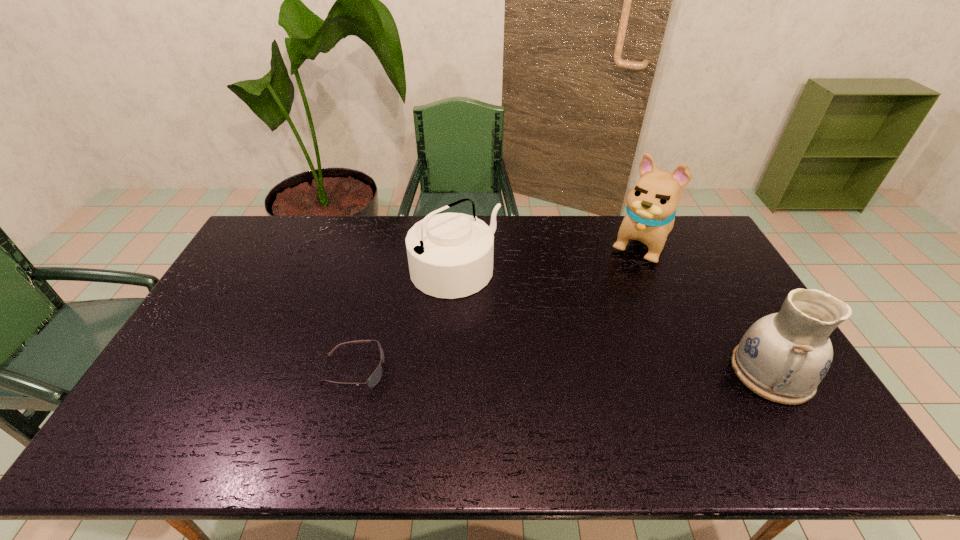
Where is `the shortest object`? the shortest object is located at coordinates (373, 380).

Locate an element on the screen. This screenshot has height=540, width=960. sunglasses is located at coordinates (373, 380).

Identify the location of pottery. (782, 357).

Identify the location of the third object from right to left. This screenshot has width=960, height=540. (x=450, y=255).

I want to click on puppy, so click(x=651, y=205).

Find the location of `free space located on the lenses of the shortest object`. free space located on the lenses of the shortest object is located at coordinates (414, 370).

Where is `vacant space located 0.340m on the back of the pottery`? This screenshot has width=960, height=540. vacant space located 0.340m on the back of the pottery is located at coordinates (708, 265).

Where is `vacant area located 0.370m on the spout of the third object from right to left`? The height and width of the screenshot is (540, 960). vacant area located 0.370m on the spout of the third object from right to left is located at coordinates (571, 366).

Find the location of a particular element. The image size is (960, 540). vacant position located on the spout of the third object from right to left is located at coordinates (568, 363).

Where is `free spot located on the spout of the third object from right to left`? free spot located on the spout of the third object from right to left is located at coordinates (574, 368).